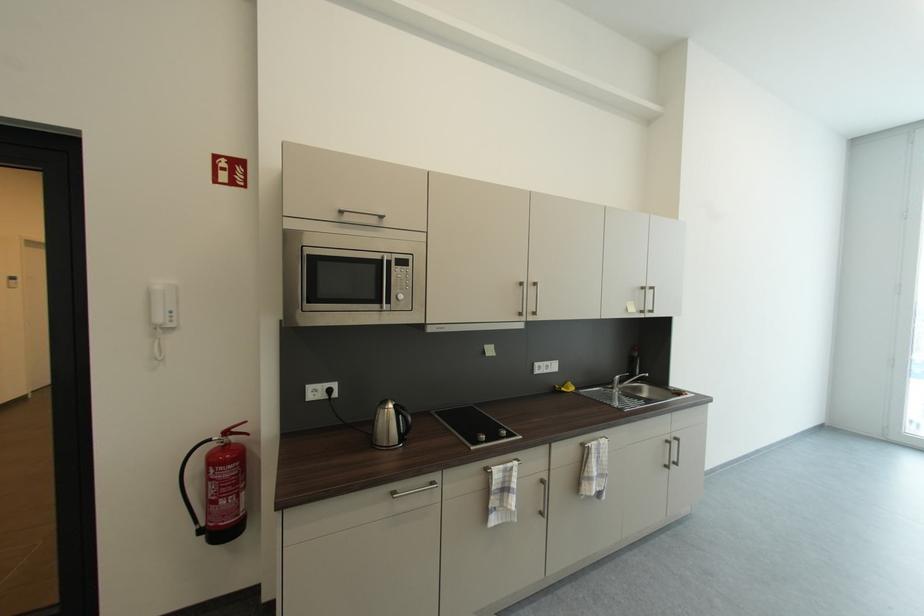
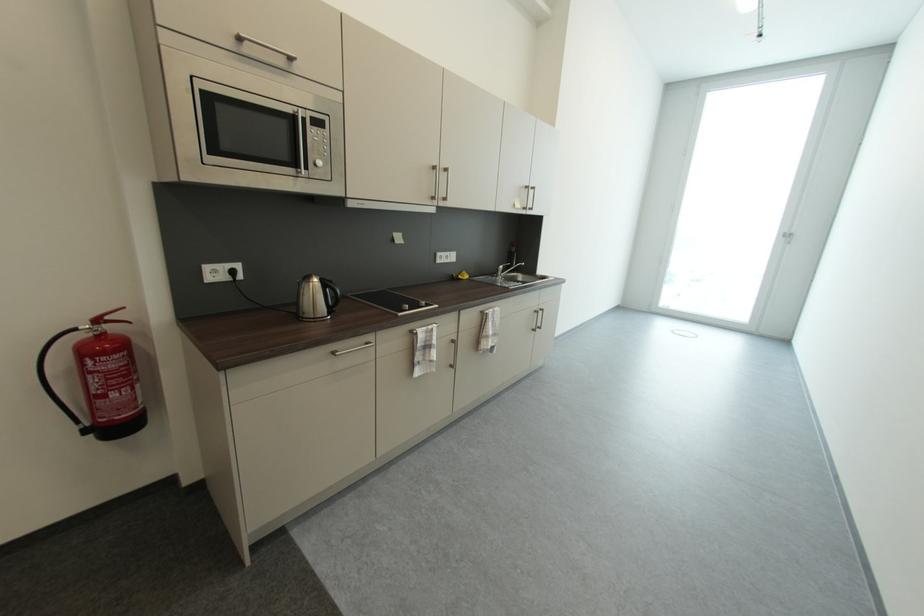
The point at (x=569, y=391) is marked in the first image. Where is the corresponding point in the second image?

(467, 278)